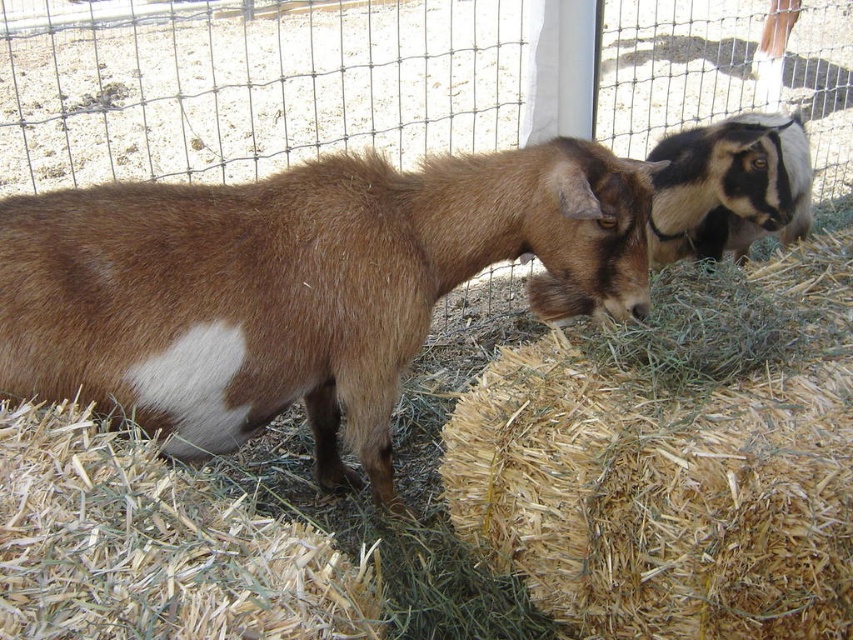
This screenshot has width=853, height=640. Describe the element at coordinates (155, 547) in the screenshot. I see `brown straw at lower left` at that location.

Who is shorter, brown straw at lower left or black and white fur goat at upper right?

Standing shorter between the two is brown straw at lower left.

Measure the distance between brown straw at lower left and camera.

34.66 inches

Identify the location of brown straw at lower left. The image size is (853, 640). (155, 547).

Is brown fuzzy goat at center positioned behind black and white fur goat at upper right?

No.

Which is more to the left, brown fuzzy goat at center or black and white fur goat at upper right?

Positioned to the left is brown fuzzy goat at center.

Image resolution: width=853 pixels, height=640 pixels. In order to click on brown fuzzy goat at center in this screenshot , I will do `click(292, 285)`.

Is brown fuzzy goat at center below brown straw bale at center?

No.

Is point (158, 189) farther from camera compared to point (682, 572)?

That is True.

Which is in front, point (218, 202) or point (555, 531)?

Point (555, 531) is more forward.

At what (x,y) coordinates should I click in order to perform the action: click on brown fuzzy goat at center. Please return your answer as a coordinate pair (x, y). The image size is (853, 640). Looking at the image, I should click on (292, 285).